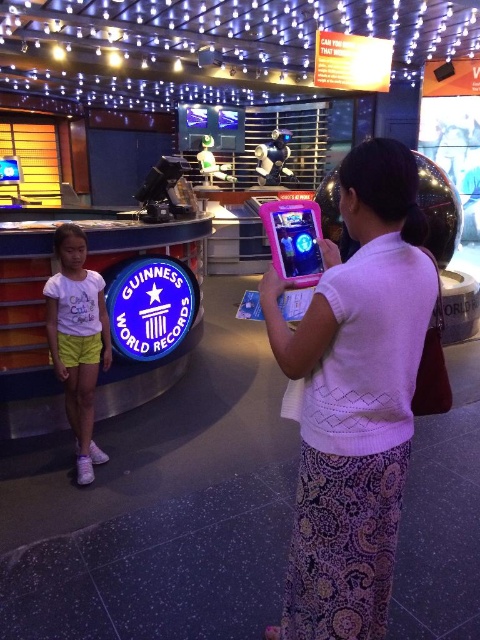
Does pink fabric tablet at center have a lesser width compared to white matte shirt at left?

No, pink fabric tablet at center is not thinner than white matte shirt at left.

Does point (308, 358) come closer to viewer compared to point (78, 316)?

Yes.

Is point (360, 300) less distant than point (93, 360)?

Yes, it is in front of point (93, 360).

You are a GUI agent. You are given a task and a screenshot of the screen. Output one action in this format:
    pyautogui.click(x=<x>, y=<y>)
    Task: Click on the pink fabric tablet at center
    
    Given the screenshot: What is the action you would take?
    pyautogui.click(x=355, y=397)

Is white matte shirt at left in front of pink plastic tablet at center?

That is False.

Does white matte shirt at left have a smaller size compared to pink plastic tablet at center?

Incorrect, white matte shirt at left is not smaller in size than pink plastic tablet at center.

Between point (55, 320) and point (294, 236), which one is positioned behind?

The point (55, 320) is behind.

Identify the location of white matte shirt at left. (78, 339).

Can you confirm if pink fabric tablet at center is positioned to the left of pink plastic tablet at center?

Incorrect, pink fabric tablet at center is not on the left side of pink plastic tablet at center.

Can you confirm if pink fabric tablet at center is bigger than pink plastic tablet at center?

Yes, pink fabric tablet at center is bigger than pink plastic tablet at center.

Locate an element on the screen. This screenshot has width=480, height=640. pink fabric tablet at center is located at coordinates (355, 397).